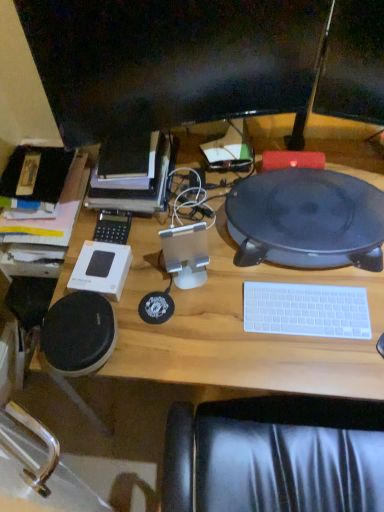
You are a GUI agent. You are given a task and a screenshot of the screen. Output one action in this format:
    pyautogui.click(x=<x>, y=<y>)
    Task: Click on the free space to the left of white plastic keyboard at lower right
    The height and width of the screenshot is (512, 384).
    Given the screenshot: What is the action you would take?
    pyautogui.click(x=221, y=320)